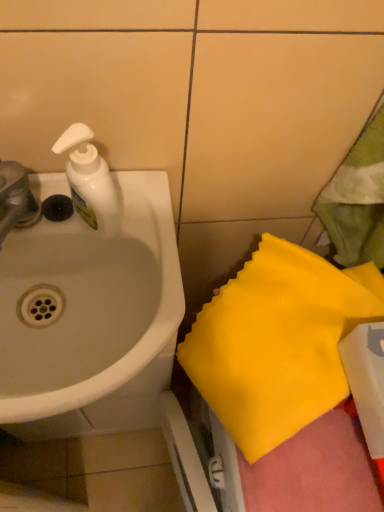
At what (x,y) coordinates should I click in order to perform the action: click on white plastic soap dispenser at upper left. Please return your answer as a coordinate pair (x, y). This screenshot has width=384, height=512. Looking at the image, I should click on (90, 181).

Measure the distance between point (78, 135) and camera.

Point (78, 135) is 17.20 inches from camera.

What do you see at coordinates (16, 199) in the screenshot? I see `metallic silver faucet at left` at bounding box center [16, 199].

Measure the distance between yellow fabric at lower right and camera.

The distance of yellow fabric at lower right from camera is 55.58 centimeters.

Locate an element on the screen. white plastic soap dispenser at upper left is located at coordinates (90, 181).

Between metallic silver faucet at left and yellow fabric at lower right, which one has more height?

Standing taller between the two is yellow fabric at lower right.

Is metallic silver faucet at left facing away from yellow fabric at lower right?

metallic silver faucet at left is not turned away from yellow fabric at lower right.

From the picture: Is metallic silver faucet at left far from yellow fabric at lower right?

A: No, metallic silver faucet at left is not far from yellow fabric at lower right.

This screenshot has height=512, width=384. In order to click on beach towel below the metallic silver faucet at left (from a real-world perspective) in this screenshot , I will do `click(278, 342)`.

Which point is more forward, [104,420] or [5,190]?

The point [5,190] is more forward.

Is white glossy sink at left oriented away from metallic silver faucet at left?

No, white glossy sink at left is not facing away from metallic silver faucet at left.

Can you confirm if white glossy sink at left is shorter than metallic silver faucet at left?

No.

Is white glossy sink at left outside of metallic silver faucet at left?

Yes, white glossy sink at left is located beyond the bounds of metallic silver faucet at left.

From the image's perspective, which object appears higher, white plastic soap dispenser at upper left or white glossy sink at left?

From the image's view, white plastic soap dispenser at upper left is above.

Is white plastic soap dispenser at upper left shorter than white glossy sink at left?

No.

This screenshot has width=384, height=512. I want to click on sink in front of the white plastic soap dispenser at upper left, so click(x=90, y=318).

Which object is thinner, white plastic soap dispenser at upper left or white glossy sink at left?

With smaller width is white plastic soap dispenser at upper left.

Considering the sizes of white plastic soap dispenser at upper left and yellow fabric at lower right in the image, is white plastic soap dispenser at upper left bigger or smaller than yellow fabric at lower right?

white plastic soap dispenser at upper left is smaller than yellow fabric at lower right.

Can you tell me how much white plastic soap dispenser at upper left and yellow fabric at lower right differ in facing direction?

The angle between the facing direction of white plastic soap dispenser at upper left and the facing direction of yellow fabric at lower right is 62.7 degrees.

Is white plastic soap dispenser at upper left behind yellow fabric at lower right?

That is False.

Who is taller, white plastic soap dispenser at upper left or yellow fabric at lower right?

white plastic soap dispenser at upper left is taller.

I want to click on sink that appears on the left of white plastic soap dispenser at upper left, so click(x=90, y=318).

Does white glossy sink at left have a lesser height compared to white plastic soap dispenser at upper left?

Indeed, white glossy sink at left has a lesser height compared to white plastic soap dispenser at upper left.

From the image's perspective, which one is positioned higher, white glossy sink at left or white plastic soap dispenser at upper left?

white plastic soap dispenser at upper left.

Is white glossy sink at left in front of or behind white plastic soap dispenser at upper left in the image?

white glossy sink at left is positioned closer to the viewer than white plastic soap dispenser at upper left.

Between point (103, 169) and point (16, 169), which one is positioned in front?

The point (103, 169) is more forward.

Can you tell me how much white plastic soap dispenser at upper left and metallic silver faucet at left differ in facing direction?

0.00395 degrees.

Is the surface of white plastic soap dispenser at upper left in direct contact with metallic silver faucet at left?

Yes, the surface of white plastic soap dispenser at upper left is in contact with metallic silver faucet at left.

Is white plastic soap dispenser at upper left to the left of metallic silver faucet at left from the viewer's perspective?

No, white plastic soap dispenser at upper left is not to the left of metallic silver faucet at left.

Does white glossy sink at left appear on the left side of yellow fabric at lower right?

Indeed, white glossy sink at left is positioned on the left side of yellow fabric at lower right.

Looking at this image, in the image, is white glossy sink at left positioned in front of or behind yellow fabric at lower right?

white glossy sink at left is positioned closer to the viewer than yellow fabric at lower right.

Who is smaller, white glossy sink at left or yellow fabric at lower right?

yellow fabric at lower right.

Is white glossy sink at left shorter than yellow fabric at lower right?

Yes, white glossy sink at left is shorter than yellow fabric at lower right.

Locate an element on the screen. tap located above the yellow fabric at lower right (from a real-world perspective) is located at coordinates (16, 199).

This screenshot has width=384, height=512. What are the coordinates of `sink in front of the metallic silver faucet at left` in the screenshot? It's located at (90, 318).

Considering their positions, is white glossy sink at left positioned closer to white plastic soap dispenser at upper left than yellow fabric at lower right?

white glossy sink at left is positioned closer to the anchor white plastic soap dispenser at upper left.

Considering their positions, is metallic silver faucet at left positioned further to white plastic soap dispenser at upper left than yellow fabric at lower right?

yellow fabric at lower right.

Which object lies nearer to the anchor point white plastic soap dispenser at upper left, metallic silver faucet at left or white glossy sink at left?

metallic silver faucet at left.

From the image, which object appears to be nearer to yellow fabric at lower right, white glossy sink at left or white plastic soap dispenser at upper left?

The object closer to yellow fabric at lower right is white glossy sink at left.

Which object lies further to the anchor point yellow fabric at lower right, white plastic soap dispenser at upper left or white glossy sink at left?

Among the two, white plastic soap dispenser at upper left is located further to yellow fabric at lower right.

Estimate the real-world distances between objects in this image. Which object is closer to metallic silver faucet at left, white plastic soap dispenser at upper left or yellow fabric at lower right?

white plastic soap dispenser at upper left is closer to metallic silver faucet at left.

From the picture: Which object lies nearer to the anchor point metallic silver faucet at left, white plastic soap dispenser at upper left or white glossy sink at left?

Among the two, white plastic soap dispenser at upper left is located nearer to metallic silver faucet at left.

When comparing their distances from metallic silver faucet at left, does yellow fabric at lower right or white glossy sink at left seem further?

Among the two, yellow fabric at lower right is located further to metallic silver faucet at left.

Find the location of a particular element. The image size is (384, 512). sink between metallic silver faucet at left and yellow fabric at lower right is located at coordinates (90, 318).

You are a GUI agent. You are given a task and a screenshot of the screen. Output one action in this format:
    pyautogui.click(x=<x>, y=<y>)
    Task: Click on the tap between white plastic soap dispenser at upper left and white glossy sink at left vertically
    
    Given the screenshot: What is the action you would take?
    pyautogui.click(x=16, y=199)

You are a GUI agent. You are given a task and a screenshot of the screen. Output one action in this format:
    pyautogui.click(x=<x>, y=<y>)
    Task: Click on the soap dispenser situated between metallic silver faucet at left and yellow fabric at lower right from left to right
    
    Given the screenshot: What is the action you would take?
    pyautogui.click(x=90, y=181)

Where is `soap dispenser between white glossy sink at left and yellow fabric at lower right`? The width and height of the screenshot is (384, 512). soap dispenser between white glossy sink at left and yellow fabric at lower right is located at coordinates (90, 181).